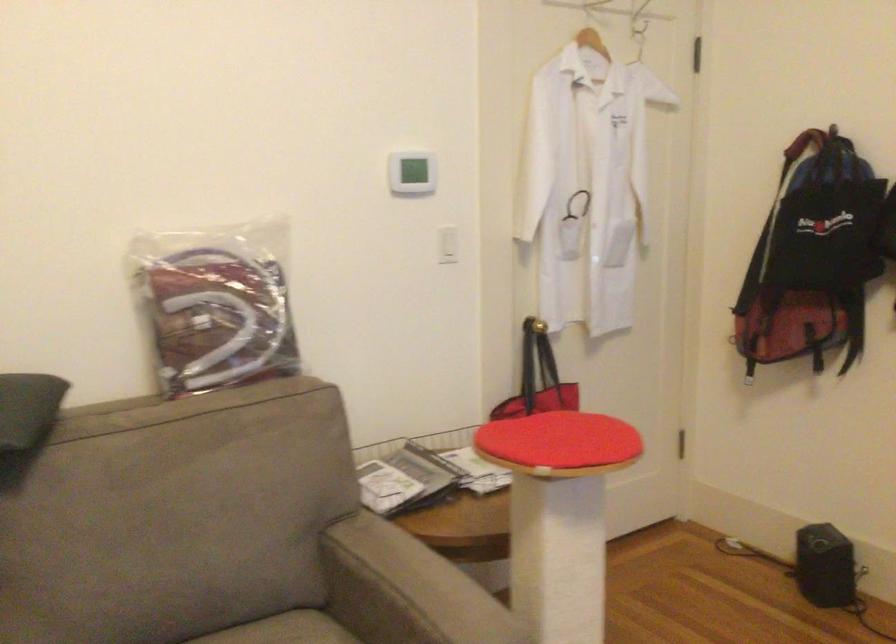
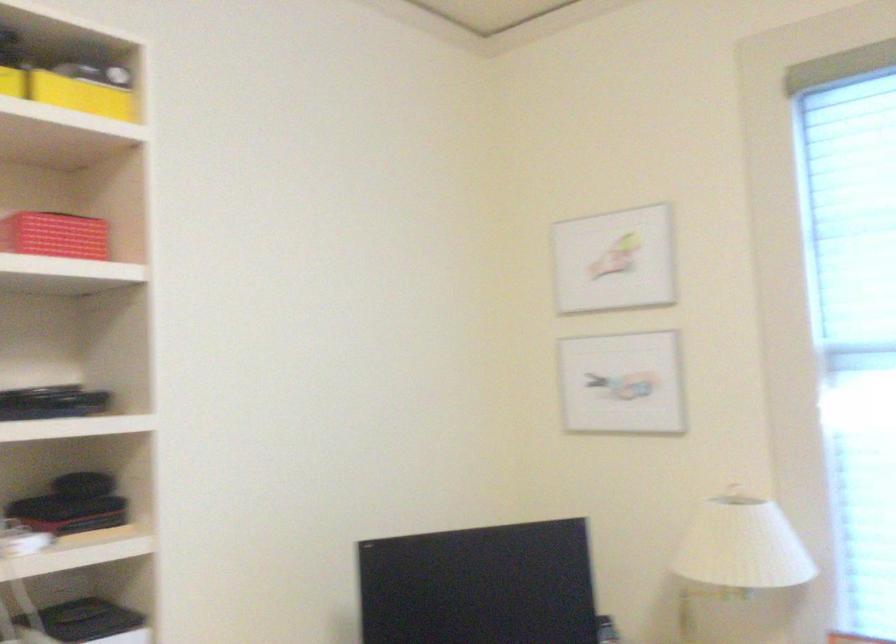
Question: Based on the continuous images, in which direction is the camera rotating? Reply with the corresponding letter.

Choices:
 (A) Left
 (B) Right
 (C) Up
 (D) Down

Answer: (B)